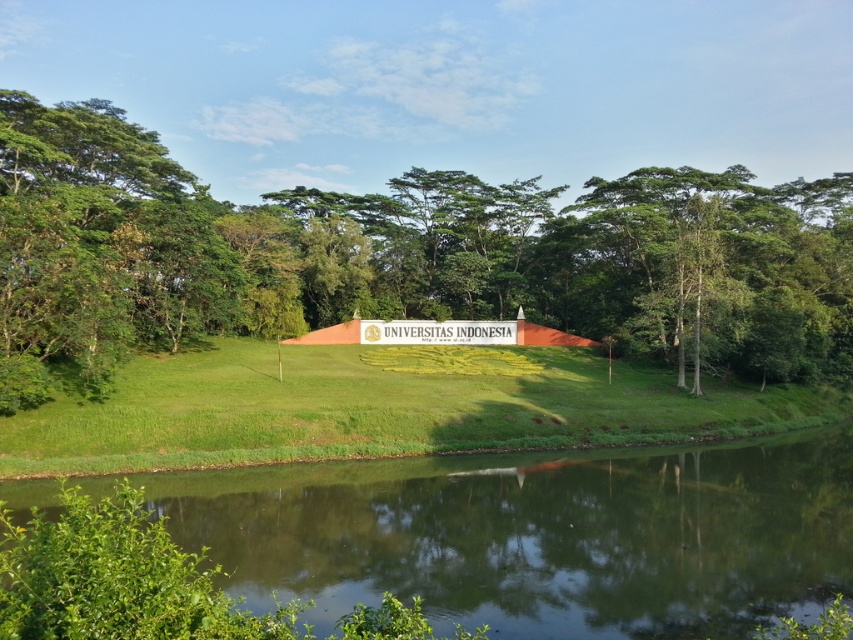
Question: Can you confirm if green smooth water at lower center is wider than green grassy hill at center?

Choices:
 (A) yes
 (B) no

Answer: (B)

Question: Which point is closer to the camera?

Choices:
 (A) (663, 426)
 (B) (778, 200)

Answer: (A)

Question: Which point is closer to the camera taking this photo?

Choices:
 (A) (674, 390)
 (B) (477, 534)

Answer: (B)

Question: Which point is closer to the camera?

Choices:
 (A) (47, 204)
 (B) (476, 577)
 (C) (109, 472)

Answer: (B)

Question: Is green leafy tree at center smaller than green smooth water at lower center?

Choices:
 (A) no
 (B) yes

Answer: (A)

Question: Is green smooth water at lower center closer to the viewer compared to green grassy hill at center?

Choices:
 (A) no
 (B) yes

Answer: (B)